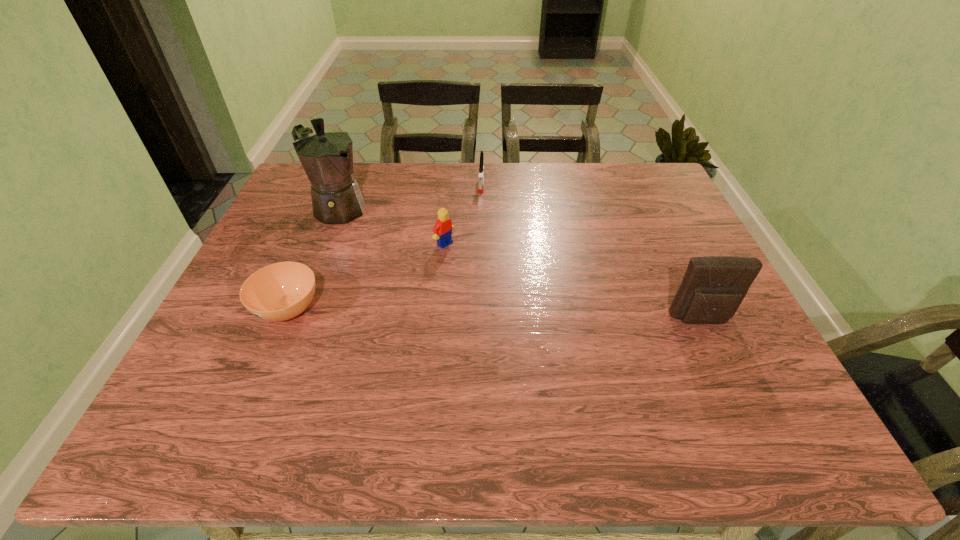
At what (x,y) coordinates should I click in order to perform the action: click on object that is the second closest to the rightmost object. Please return your answer as a coordinate pair (x, y). The height and width of the screenshot is (540, 960). Looking at the image, I should click on (481, 173).

Image resolution: width=960 pixels, height=540 pixels. I want to click on object that stands as the second closest to the rightmost object, so click(x=481, y=173).

Where is `vacant position in the image that satisfies the following two spatial constraints: 1. on the back side of the fourth tallest object; 2. on the right side of the third nearest object`? This screenshot has height=540, width=960. vacant position in the image that satisfies the following two spatial constraints: 1. on the back side of the fourth tallest object; 2. on the right side of the third nearest object is located at coordinates (450, 183).

Image resolution: width=960 pixels, height=540 pixels. What are the coordinates of `free space that satisfies the following two spatial constraints: 1. on the back side of the soup bowl; 2. on the right side of the tallest object` in the screenshot? It's located at (330, 208).

Locate an element on the screen. The width and height of the screenshot is (960, 540). vacant space that satisfies the following two spatial constraints: 1. on the back side of the second shortest object; 2. on the left side of the third object from right to left is located at coordinates (450, 183).